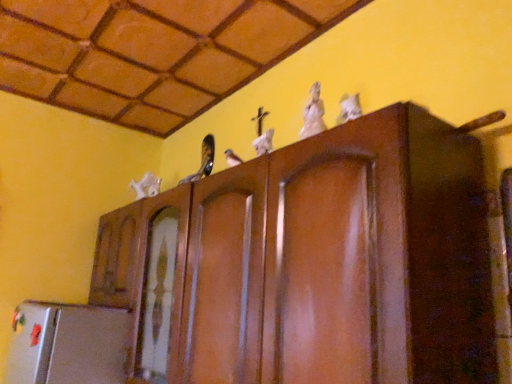
Question: Is white glossy statue at upper center, which appears as the second animal when viewed from the right, positioned with its back to white glossy cat at upper right, which is counted as the first animal, starting from the right?

Choices:
 (A) no
 (B) yes

Answer: (A)

Question: Does white glossy statue at upper center, the second animal in the left-to-right sequence, come behind white glossy cat at upper right, the third animal viewed from the left?

Choices:
 (A) no
 (B) yes

Answer: (B)

Question: Does white glossy statue at upper center, placed as the 2th animal when sorted from front to back, have a smaller size compared to white glossy cat at upper right, the 1th animal viewed from the front?

Choices:
 (A) yes
 (B) no

Answer: (B)

Question: From the image's perspective, is white glossy statue at upper center, the second animal in the left-to-right sequence, located above white glossy cat at upper right, which is counted as the first animal, starting from the right?

Choices:
 (A) yes
 (B) no

Answer: (A)

Question: Could you tell me if white glossy statue at upper center, placed as the 2th animal when sorted from front to back, is facing white glossy cat at upper right, which is counted as the first animal, starting from the right?

Choices:
 (A) no
 (B) yes

Answer: (A)

Question: From the image's perspective, relative to white glossy statue at upper center, the second animal in the left-to-right sequence, is white matte animal at left, which is counted as the first animal, starting from the back, above or below?

Choices:
 (A) below
 (B) above

Answer: (A)

Question: From a real-world perspective, is white matte animal at left, placed as the third animal when sorted from right to left, above or below white glossy statue at upper center, which appears as the second animal when viewed from the right?

Choices:
 (A) above
 (B) below

Answer: (A)

Question: In terms of size, does white matte animal at left, which is the 1th animal in left-to-right order, appear bigger or smaller than white glossy statue at upper center, the second animal in the left-to-right sequence?

Choices:
 (A) big
 (B) small

Answer: (A)

Question: Considering their positions, is white matte animal at left, placed as the third animal when sorted from right to left, located in front of or behind white glossy statue at upper center, which ranks as the 2th animal in back-to-front order?

Choices:
 (A) behind
 (B) front

Answer: (A)

Question: Is white glossy cat at upper right, the third animal viewed from the left, inside or outside of white glossy statue at upper center, which ranks as the 2th animal in back-to-front order?

Choices:
 (A) outside
 (B) inside

Answer: (A)

Question: Based on their sizes in the image, would you say white glossy cat at upper right, which is counted as the first animal, starting from the right, is bigger or smaller than white glossy statue at upper center, which appears as the second animal when viewed from the right?

Choices:
 (A) big
 (B) small

Answer: (B)

Question: Relative to white glossy statue at upper center, which appears as the second animal when viewed from the right, is white glossy cat at upper right, the third animal viewed from the left, in front or behind?

Choices:
 (A) behind
 (B) front

Answer: (B)

Question: Is point (356, 107) closer or farther from the camera than point (305, 122)?

Choices:
 (A) closer
 (B) farther

Answer: (B)

Question: Is white matte animal at left, which is the 1th animal in left-to-right order, taller or shorter than white glossy cat at upper right, which is counted as the first animal, starting from the right?

Choices:
 (A) short
 (B) tall

Answer: (B)

Question: Does point (144, 193) appear closer or farther from the camera than point (345, 119)?

Choices:
 (A) closer
 (B) farther

Answer: (B)